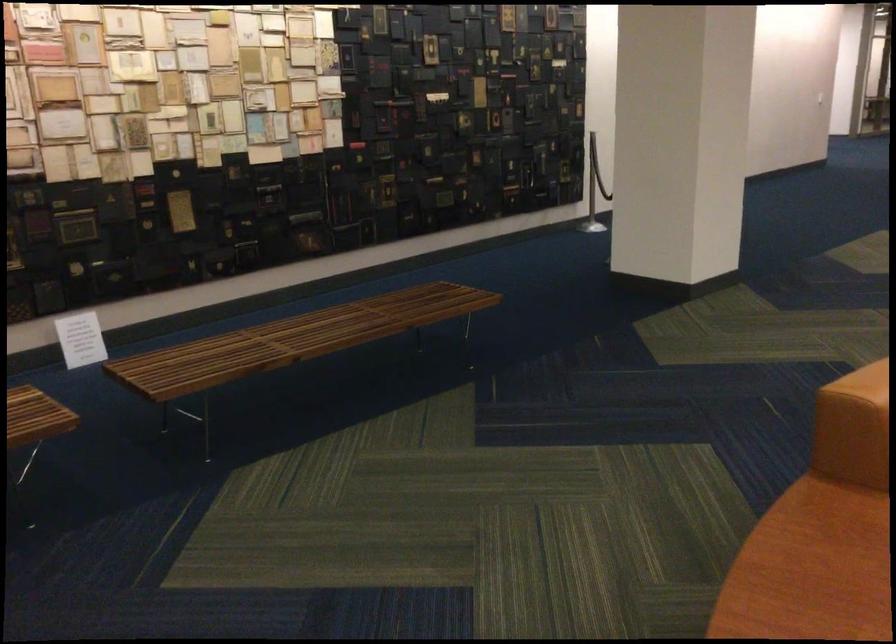
The image size is (896, 644). In order to click on sofa armrest in this screenshot , I will do `click(811, 569)`.